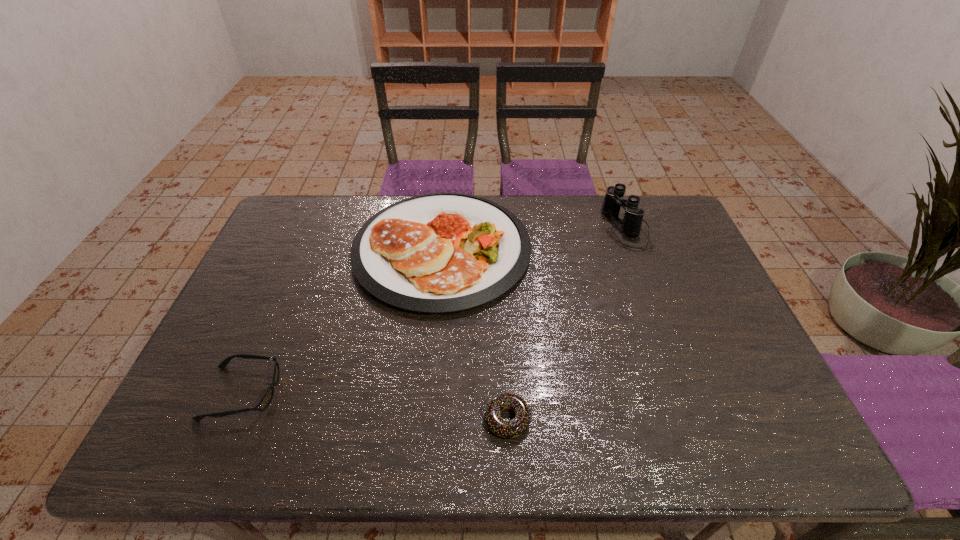
Locate an element on the screen. free location at the left edge is located at coordinates (244, 349).

Where is `free spot at the right edge of the desktop`? This screenshot has width=960, height=540. free spot at the right edge of the desktop is located at coordinates (717, 352).

You are a GUI agent. You are given a task and a screenshot of the screen. Output one action in this format:
    pyautogui.click(x=<x>, y=<y>)
    Task: Click on the free space at the near right corner
    
    Given the screenshot: What is the action you would take?
    pyautogui.click(x=781, y=434)

The image size is (960, 540). I want to click on free space between the third shortest object and the leftmost object, so click(x=343, y=321).

Identify the location of empty space that is in between the leftmost object and the doughnut. (375, 406).

Image resolution: width=960 pixels, height=540 pixels. In order to click on free area in between the leftmost object and the doughnut in this screenshot , I will do `click(375, 406)`.

This screenshot has height=540, width=960. I want to click on free space that is in between the second shortest object and the dish, so click(x=343, y=321).

Where is `vacant area that lies between the doughnut and the tallest object`? The height and width of the screenshot is (540, 960). vacant area that lies between the doughnut and the tallest object is located at coordinates (566, 323).

The height and width of the screenshot is (540, 960). I want to click on vacant space that's between the doughnut and the binoculars, so click(x=566, y=323).

This screenshot has width=960, height=540. Identify the location of unoccupied position between the doughnut and the spectacles. (x=375, y=406).